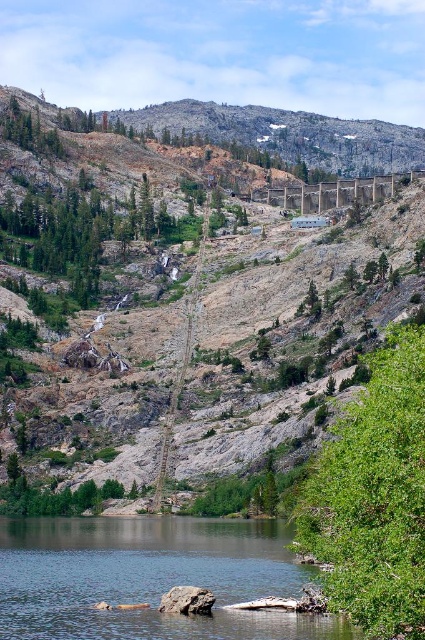
Question: Does green leafy tree at right come behind green leafy tree at upper left?

Choices:
 (A) no
 (B) yes

Answer: (A)

Question: Which object is the closest to the green leafy tree at upper left?

Choices:
 (A) clear water at lower center
 (B) gray rock at lower center

Answer: (A)

Question: Among these points, which one is farthest from the camera?

Choices:
 (A) (13, 612)
 (B) (413, 563)

Answer: (A)

Question: Which point appears closest to the camera in this image?

Choices:
 (A) (396, 592)
 (B) (187, 604)
 (C) (365, 192)

Answer: (A)

Question: Is clear water at lower center positioned before green leafy tree at right?

Choices:
 (A) yes
 (B) no

Answer: (B)

Question: Can you confirm if green leafy tree at upper left is positioned to the left of gray rock at lower center?

Choices:
 (A) yes
 (B) no

Answer: (A)